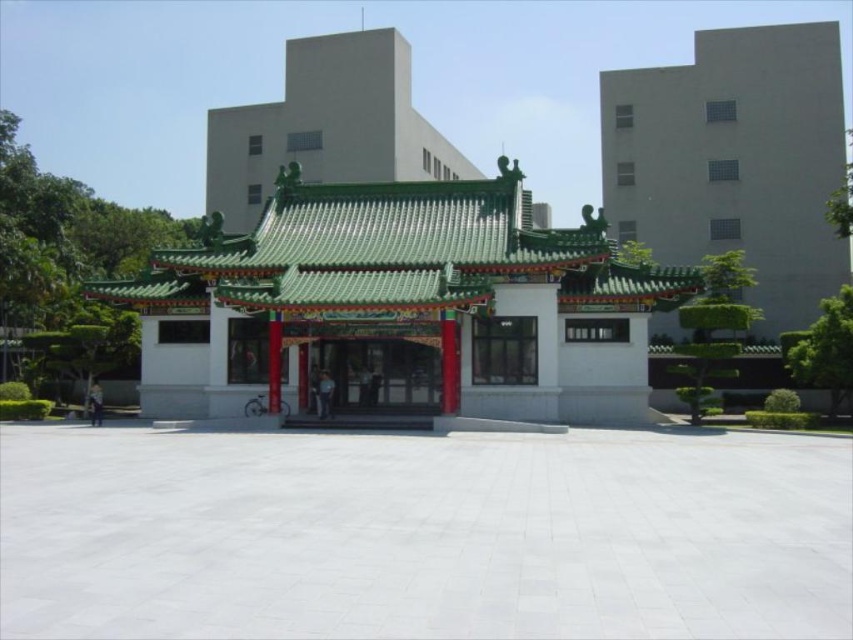
You are standing in the courtyard and want to enter the pavilion. You see the smooth concrete building at upper right and the matte red door at center. Which object is closer to your current position?

The matte red door at center is closer to your current position because the smooth concrete building at upper right is positioned over it, meaning the door is in front.

You are a visitor at the courtyard and want to take a photo of both the smooth concrete building at upper right and the matte red door at center. Since you have a wide angle lens, which object should you focus on first to ensure both are in frame?

The smooth concrete building at upper right is larger in size than the matte red door at center, so you should focus on the matte red door at center first to ensure both are in frame.

You are standing in the courtyard and want to enter the matte red door at center. Which direction should you walk relative to the green tile roof gazebo at center to reach the door?

The green tile roof gazebo at center is positioned over the matte red door at center, so you should walk directly underneath the gazebo to reach the door.